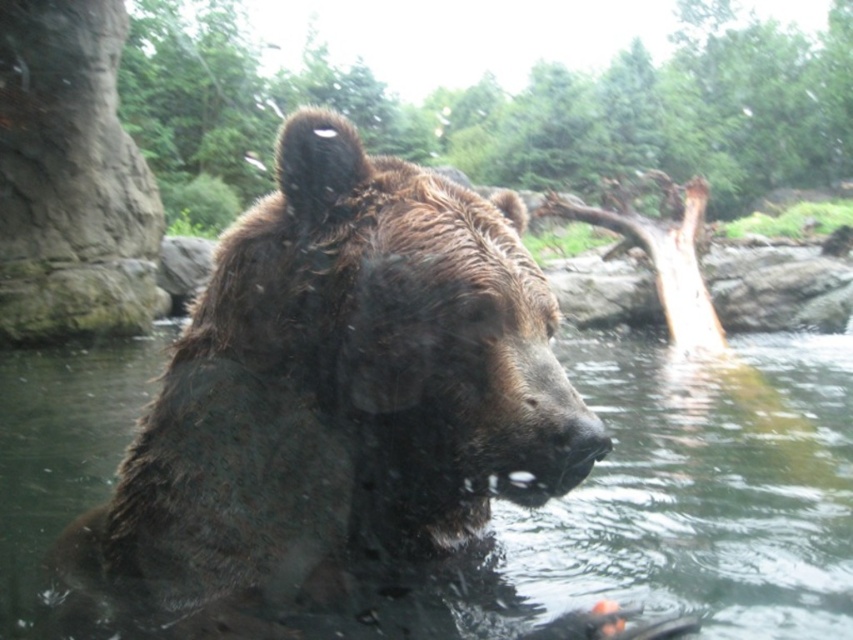
Question: Which point is farther to the camera?

Choices:
 (A) wet fur bear at center
 (B) brown wet fur at center

Answer: (B)

Question: Which of the following is the farthest from the observer?

Choices:
 (A) brown wet fur at center
 (B) wet fur bear at center

Answer: (A)

Question: Does wet fur bear at center appear over brown wet fur at center?

Choices:
 (A) yes
 (B) no

Answer: (A)

Question: Where is wet fur bear at center located in relation to brown wet fur at center in the image?

Choices:
 (A) below
 (B) above

Answer: (B)

Question: In this image, where is wet fur bear at center located relative to brown wet fur at center?

Choices:
 (A) right
 (B) left

Answer: (A)